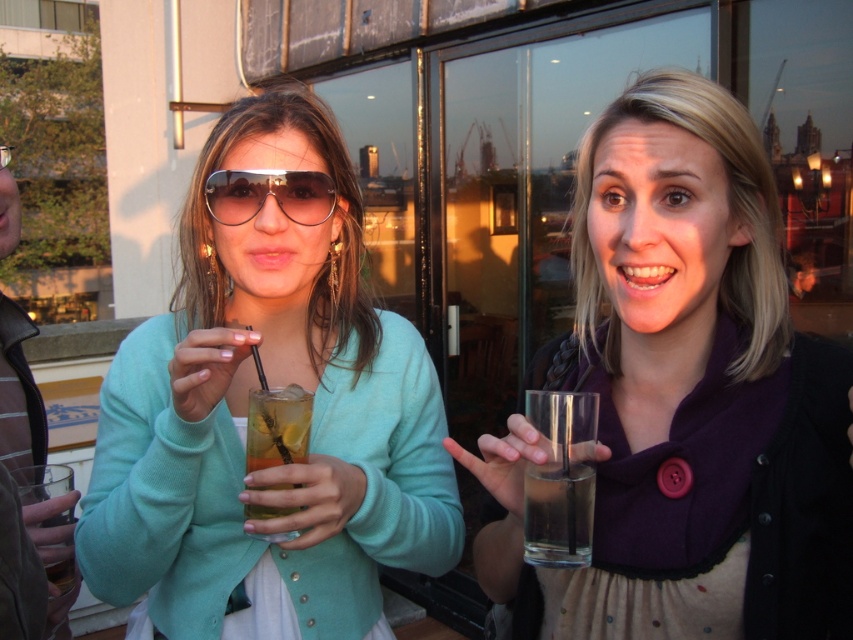
Question: Does clear glass water at center appear on the right side of translucent glass drink at center?

Choices:
 (A) no
 (B) yes

Answer: (B)

Question: Among these objects, which one is farthest from the camera?

Choices:
 (A) clear glass water at center
 (B) metallic aviator sunglasses at center
 (C) matte teal sweater at center

Answer: (B)

Question: Estimate the real-world distances between objects in this image. Which object is closer to the clear glass water at center?

Choices:
 (A) matte black sweater at upper right
 (B) translucent glass drink at center

Answer: (A)

Question: Can you confirm if matte teal sweater at center is positioned to the left of metallic aviator sunglasses at center?

Choices:
 (A) no
 (B) yes

Answer: (A)

Question: Is matte teal sweater at center below translucent glass drink at center?

Choices:
 (A) yes
 (B) no

Answer: (B)

Question: Which object is farther from the camera taking this photo?

Choices:
 (A) matte teal sweater at center
 (B) translucent glass drink at center
 (C) metallic aviator sunglasses at center

Answer: (C)